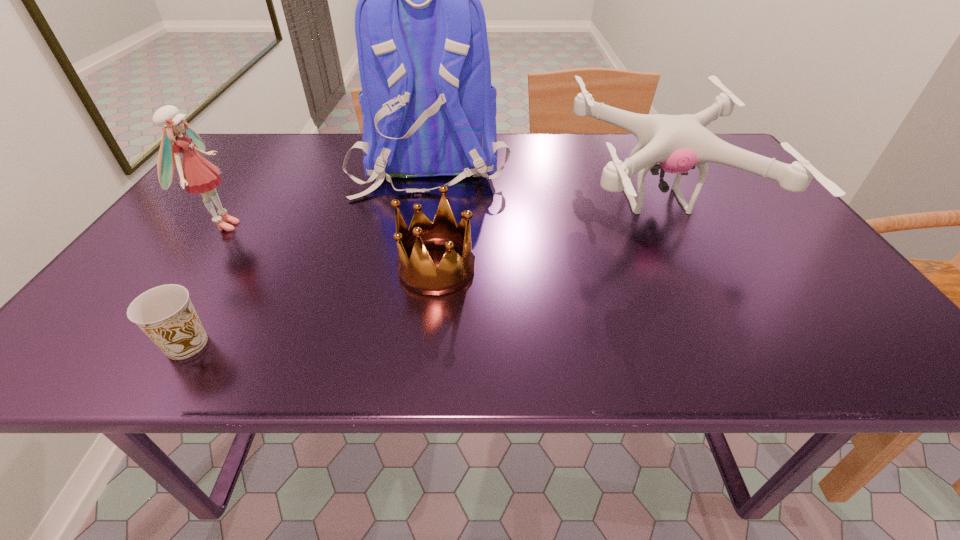
Where is `free point at the far edge`? The height and width of the screenshot is (540, 960). free point at the far edge is located at coordinates coord(576,136).

In the image, there is a desktop. Identify the location of vacant space at the near edge. (507, 356).

The image size is (960, 540). What are the coordinates of `free space at the left edge of the desktop` in the screenshot? It's located at (238, 200).

At what (x,y) coordinates should I click in order to perform the action: click on vacant region at the right edge of the desktop. Please return your answer as a coordinate pair (x, y). Looking at the image, I should click on (724, 213).

You are a GUI agent. You are given a task and a screenshot of the screen. Output one action in this format:
    pyautogui.click(x=<x>, y=<y>)
    Task: Click on the vacant area at the far left corner of the desktop
    The width and height of the screenshot is (960, 540).
    Given the screenshot: What is the action you would take?
    pyautogui.click(x=265, y=163)

The width and height of the screenshot is (960, 540). In the image, there is a desktop. In order to click on vacant area at the near right corner in this screenshot , I will do `click(886, 354)`.

You are a GUI agent. You are given a task and a screenshot of the screen. Output one action in this format:
    pyautogui.click(x=<x>, y=<y>)
    Task: Click on the empty space between the crown and the nearest object
    This screenshot has height=540, width=960.
    Given the screenshot: What is the action you would take?
    pyautogui.click(x=312, y=306)

Find the location of `empty space between the nearest object and the fourth tallest object`. empty space between the nearest object and the fourth tallest object is located at coordinates (312, 306).

At what (x,y) coordinates should I click in order to perform the action: click on unoccupied area between the tallest object and the drone. Please return your answer as a coordinate pair (x, y). The image size is (960, 540). Looking at the image, I should click on (543, 183).

Identify the location of vacant area that lies between the doll and the backpack. This screenshot has width=960, height=540. (326, 195).